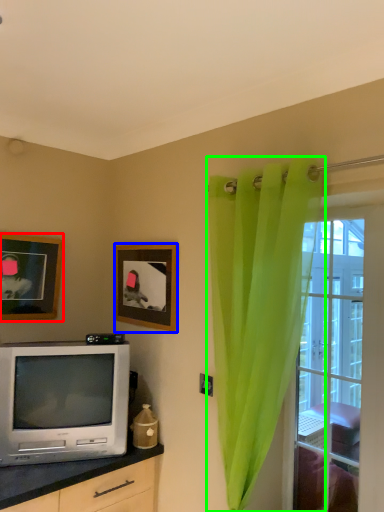
Question: Which object is the farthest from picture frame (highlighted by a red box)? Choose among these: picture frame (highlighted by a blue box) or curtain (highlighted by a green box).

Choices:
 (A) picture frame
 (B) curtain

Answer: (B)